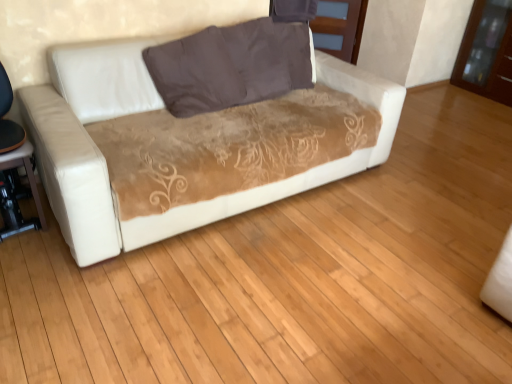
Question: Is matte brown wood dresser at upper center, acting as the second dresser starting from the right, completely or partially inside brown glossy dresser at upper right, acting as the first dresser starting from the right?

Choices:
 (A) yes
 (B) no

Answer: (B)

Question: From a real-world perspective, is brown glossy dresser at upper right, acting as the first dresser starting from the right, below matte brown wood dresser at upper center, acting as the second dresser starting from the right?

Choices:
 (A) no
 (B) yes

Answer: (A)

Question: Does brown glossy dresser at upper right, acting as the first dresser starting from the right, have a greater width compared to matte brown wood dresser at upper center, placed as the first dresser when sorted from left to right?

Choices:
 (A) yes
 (B) no

Answer: (A)

Question: Does brown glossy dresser at upper right, the second dresser viewed from the left, have a smaller size compared to matte brown wood dresser at upper center, placed as the first dresser when sorted from left to right?

Choices:
 (A) yes
 (B) no

Answer: (B)

Question: Is brown glossy dresser at upper right, the second dresser viewed from the left, at the right side of matte brown wood dresser at upper center, placed as the first dresser when sorted from left to right?

Choices:
 (A) no
 (B) yes

Answer: (B)

Question: Is brown glossy dresser at upper right, the second dresser viewed from the left, further to camera compared to matte brown wood dresser at upper center, acting as the second dresser starting from the right?

Choices:
 (A) yes
 (B) no

Answer: (B)

Question: Is matte brown wood dresser at upper center, placed as the first dresser when sorted from left to right, completely or partially inside white leather couch at center?

Choices:
 (A) no
 (B) yes

Answer: (A)

Question: Is white leather couch at center closer to camera compared to matte brown wood dresser at upper center, acting as the second dresser starting from the right?

Choices:
 (A) no
 (B) yes

Answer: (B)

Question: Can you confirm if white leather couch at center is taller than matte brown wood dresser at upper center, placed as the first dresser when sorted from left to right?

Choices:
 (A) yes
 (B) no

Answer: (A)

Question: From the image's perspective, does white leather couch at center appear higher than matte brown wood dresser at upper center, acting as the second dresser starting from the right?

Choices:
 (A) yes
 (B) no

Answer: (B)

Question: Is white leather couch at center positioned far away from matte brown wood dresser at upper center, placed as the first dresser when sorted from left to right?

Choices:
 (A) yes
 (B) no

Answer: (A)

Question: Would you say white leather couch at center is outside matte brown wood dresser at upper center, placed as the first dresser when sorted from left to right?

Choices:
 (A) no
 (B) yes

Answer: (B)

Question: From a real-world perspective, is matte brown wood dresser at upper center, placed as the first dresser when sorted from left to right, positioned under brown fabric pillow at center based on gravity?

Choices:
 (A) no
 (B) yes

Answer: (B)